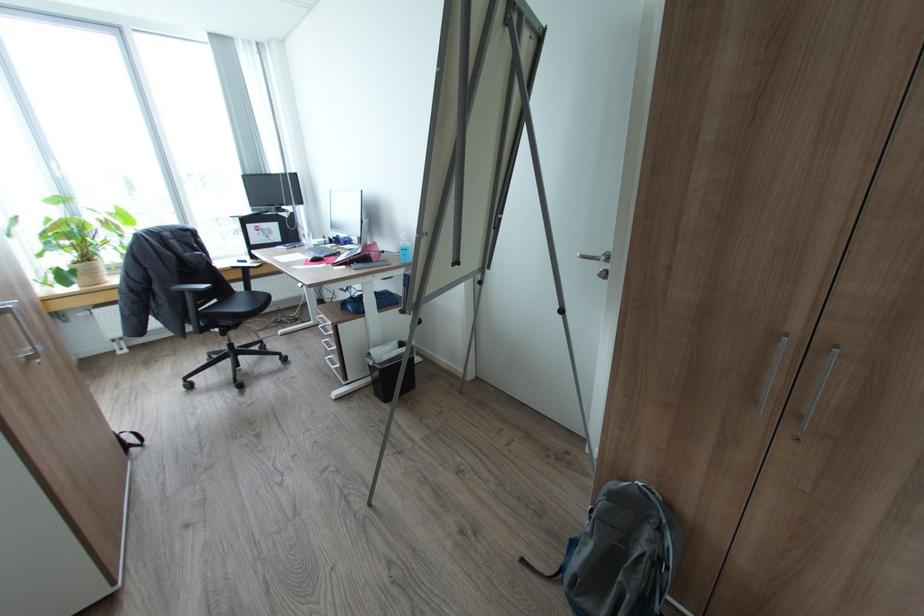
Find where to sit the chair sitting surface. Please return your answer as a coordinate pair (x, y).

(239, 302)